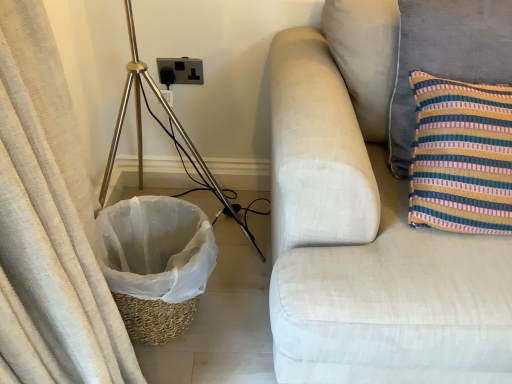
Question: Could you tell me if striped fabric pillow at right is turned towards black plastic outlet at center?

Choices:
 (A) no
 (B) yes

Answer: (A)

Question: From a real-world perspective, is striped fabric pillow at right physically above black plastic outlet at center?

Choices:
 (A) yes
 (B) no

Answer: (A)

Question: Is striped fabric pillow at right thinner than black plastic outlet at center?

Choices:
 (A) no
 (B) yes

Answer: (A)

Question: Considering the relative sizes of striped fabric pillow at right and black plastic outlet at center in the image provided, is striped fabric pillow at right taller than black plastic outlet at center?

Choices:
 (A) no
 (B) yes

Answer: (B)

Question: Is striped fabric pillow at right positioned behind black plastic outlet at center?

Choices:
 (A) yes
 (B) no

Answer: (B)

Question: Are striped fabric pillow at right and black plastic outlet at center located far from each other?

Choices:
 (A) yes
 (B) no

Answer: (B)

Question: From the image's perspective, is braided straw laundry basket at lower left above gold metallic tripod at left?

Choices:
 (A) no
 (B) yes

Answer: (A)

Question: Does braided straw laundry basket at lower left have a lesser height compared to gold metallic tripod at left?

Choices:
 (A) no
 (B) yes

Answer: (B)

Question: Is braided straw laundry basket at lower left positioned far away from gold metallic tripod at left?

Choices:
 (A) yes
 (B) no

Answer: (B)

Question: Can you confirm if braided straw laundry basket at lower left is wider than gold metallic tripod at left?

Choices:
 (A) yes
 (B) no

Answer: (B)

Question: Is braided straw laundry basket at lower left at the right side of gold metallic tripod at left?

Choices:
 (A) no
 (B) yes

Answer: (A)

Question: Is braided straw laundry basket at lower left positioned in front of gold metallic tripod at left?

Choices:
 (A) yes
 (B) no

Answer: (B)

Question: From the image's perspective, is gold metallic tripod at left below light beige fabric couch at right?

Choices:
 (A) no
 (B) yes

Answer: (A)